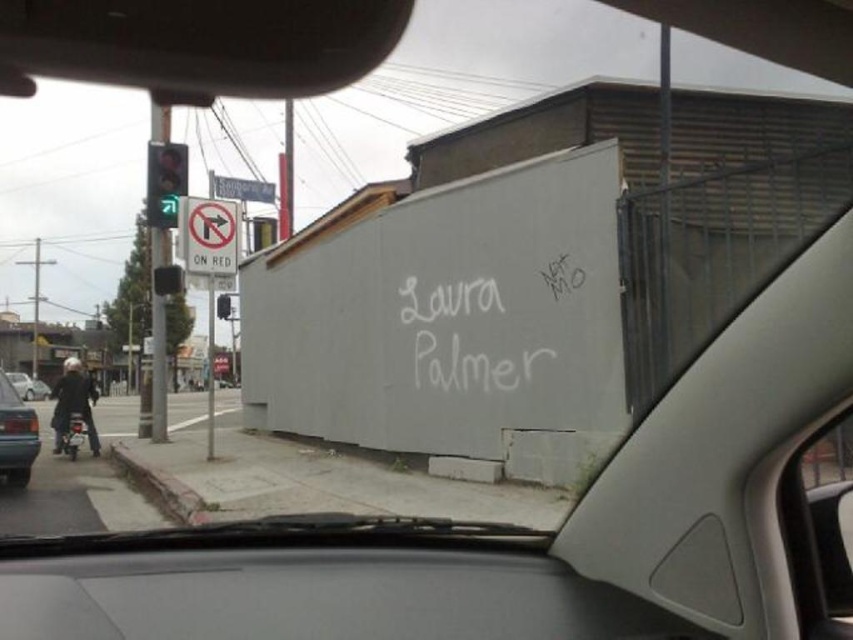
You are sitting in the driver seat of the vehicle and want to check the distance between the two points on the wall. Which point is closer to you, point (555, 355) or point (253, 180)?

Point (555, 355) is in front of point (253, 180), so it is closer to you.

You are a pedestrian standing on the sidewalk. You see the white chalk writing at center and the green glass traffic light at left. Which object is closer to the ground?

The white chalk writing at center is positioned under the green glass traffic light at left, so the white chalk writing at center is closer to the ground.

You are sitting in the driver seat of the vehicle and want to look at two points on the wall with graffiti. The first point is at coordinate point (471, 310) and the second point is at coordinate point (151, 221). Which point will you see first as you look from the windshield towards the wall?

Point (471, 310) is closer to the viewer than point (151, 221), so you will see point (471, 310) first as you look from the windshield towards the wall.